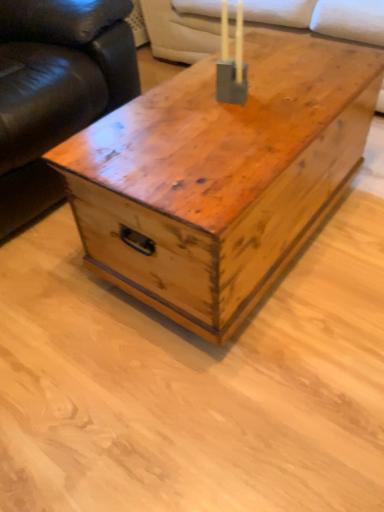
The image size is (384, 512). In order to click on vacant area that is in front of wooden trunk at center in this screenshot , I will do `click(234, 385)`.